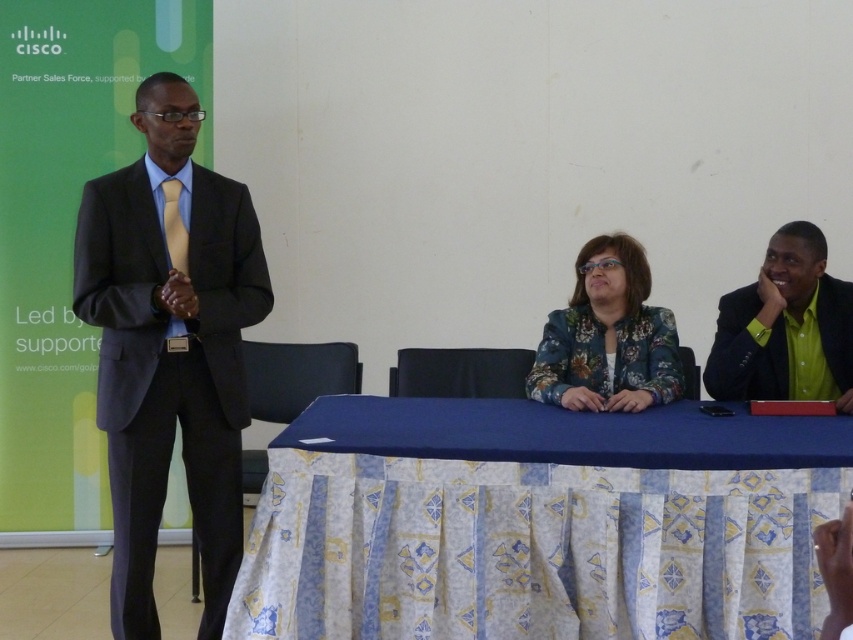
You are an event planner arranging seating for the next session. The venue has a stage with limited space. You need to determine if the matte black suit at left and the yellow satin tie at left can be accommodated side by side on the stage. Can you confirm their spatial arrangement based on the current setup?

The matte black suit at left is in front of the yellow satin tie at left, so they are not side by side but rather one in front of the other. Therefore, they can be accommodated side by side on the stage as their current positions do not block each other horizontally.

You are an event planner who needs to ensure that the distance between the matte black suit at left and the yellow satin tie at left is sufficient for a microphone stand placement. The stand requires at least 12 inches of space. Can the stand fit between them?

The matte black suit at left and the yellow satin tie at left are 12.37 inches apart from each other, which is more than the required 12 inches. Therefore, the microphone stand can fit between them.

You are a photographer at the event and need to capture a group photo of the matte black suit at left and the green matte shirt at right. The camera you are using has a maximum focus range of 6 feet. Will both subjects be in focus if you position the camera equidistant between them?

The matte black suit at left and green matte shirt at right are 5.97 feet apart. If the camera is placed equidistant between them, each subject will be approximately 2.985 feet from the center point. Since the maximum focus range is 6 feet, both subjects will be within the focus range and in focus.